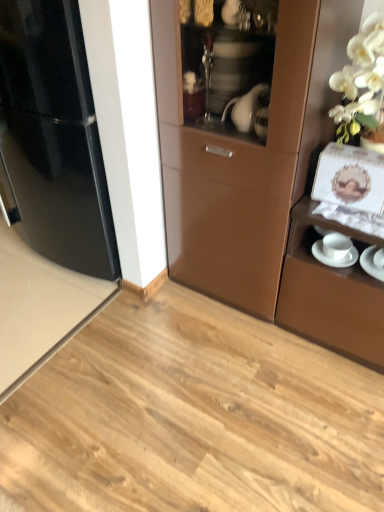
Question: Does white glossy saucer at right, which ranks as the 1th saucer in left-to-right order, appear on the left side of glossy black refrigerator at left?

Choices:
 (A) no
 (B) yes

Answer: (A)

Question: Can you confirm if white glossy saucer at right, which ranks as the 1th saucer in left-to-right order, is taller than glossy black refrigerator at left?

Choices:
 (A) yes
 (B) no

Answer: (B)

Question: Considering the relative sizes of white glossy saucer at right, which ranks as the 1th saucer in left-to-right order, and glossy black refrigerator at left in the image provided, is white glossy saucer at right, which ranks as the 1th saucer in left-to-right order, smaller than glossy black refrigerator at left?

Choices:
 (A) yes
 (B) no

Answer: (A)

Question: Is white glossy saucer at right, which is the second saucer from right to left, oriented towards glossy black refrigerator at left?

Choices:
 (A) yes
 (B) no

Answer: (B)

Question: Does white glossy saucer at right, which is the second saucer from right to left, have a lesser width compared to glossy black refrigerator at left?

Choices:
 (A) no
 (B) yes

Answer: (B)

Question: Considering the positions of white glossy saucer at lower right, marked as the second saucer in a left-to-right arrangement, and white glossy saucer at right, which ranks as the 1th saucer in left-to-right order, in the image, is white glossy saucer at lower right, marked as the second saucer in a left-to-right arrangement, taller or shorter than white glossy saucer at right, which ranks as the 1th saucer in left-to-right order,?

Choices:
 (A) short
 (B) tall

Answer: (A)

Question: In terms of width, does white glossy saucer at lower right, the first saucer in the right-to-left sequence, look wider or thinner when compared to white glossy saucer at right, which is the second saucer from right to left?

Choices:
 (A) wide
 (B) thin

Answer: (A)

Question: Is point (377, 268) positioned closer to the camera than point (357, 256)?

Choices:
 (A) closer
 (B) farther

Answer: (A)

Question: From a real-world perspective, is white glossy saucer at lower right, marked as the second saucer in a left-to-right arrangement, physically located above or below white glossy saucer at right, which ranks as the 1th saucer in left-to-right order?

Choices:
 (A) above
 (B) below

Answer: (A)

Question: From the image's perspective, is white glossy saucer at right, which is the second saucer from right to left, located above or below glossy black refrigerator at left?

Choices:
 (A) above
 (B) below

Answer: (B)

Question: In the image, is white glossy saucer at right, which ranks as the 1th saucer in left-to-right order, positioned in front of or behind glossy black refrigerator at left?

Choices:
 (A) front
 (B) behind

Answer: (A)

Question: In the image, is white glossy saucer at right, which ranks as the 1th saucer in left-to-right order, on the left side or the right side of glossy black refrigerator at left?

Choices:
 (A) right
 (B) left

Answer: (A)

Question: Considering the positions of white glossy saucer at right, which ranks as the 1th saucer in left-to-right order, and glossy black refrigerator at left in the image, is white glossy saucer at right, which ranks as the 1th saucer in left-to-right order, wider or thinner than glossy black refrigerator at left?

Choices:
 (A) thin
 (B) wide

Answer: (A)

Question: Is glossy black refrigerator at left bigger or smaller than white glossy saucer at right, which ranks as the 1th saucer in left-to-right order?

Choices:
 (A) small
 (B) big

Answer: (B)

Question: From a real-world perspective, is glossy black refrigerator at left positioned above or below white glossy saucer at right, which ranks as the 1th saucer in left-to-right order?

Choices:
 (A) below
 (B) above

Answer: (B)